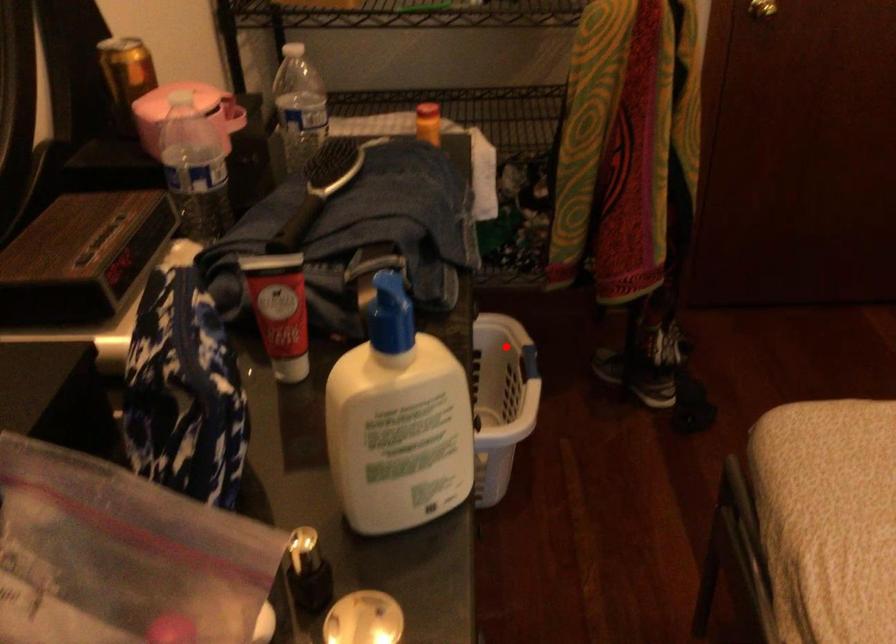
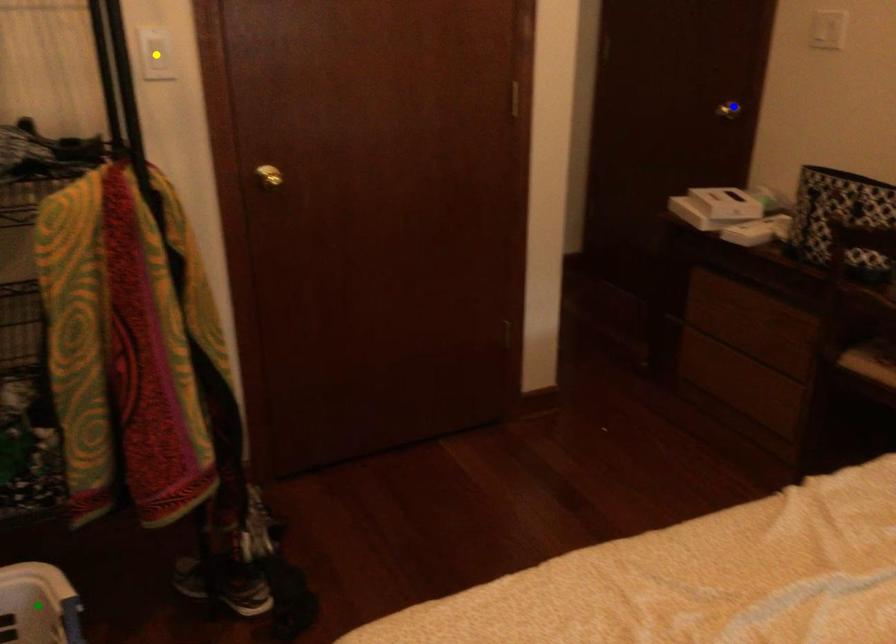
Question: I am providing you with two images of the same scene from different viewpoints. A red point is marked on the first image. You are given multiple points on the second image. Which point in image 2 is actually the same real-world point as the red point in image 1?

Choices:
 (A) blue point
 (B) yellow point
 (C) green point

Answer: (C)